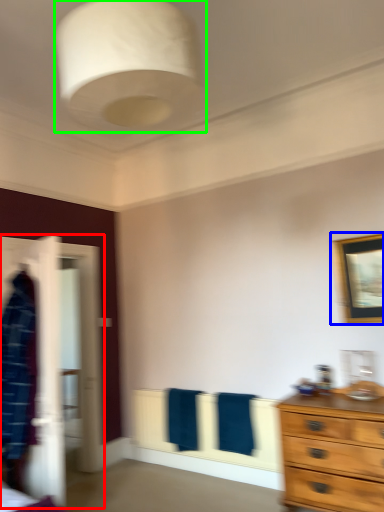
Question: Estimate the real-world distances between objects in this image. Which object is closer to closet (highlighted by a red box), picture frame (highlighted by a blue box) or light fixture (highlighted by a green box)?

Choices:
 (A) picture frame
 (B) light fixture

Answer: (A)